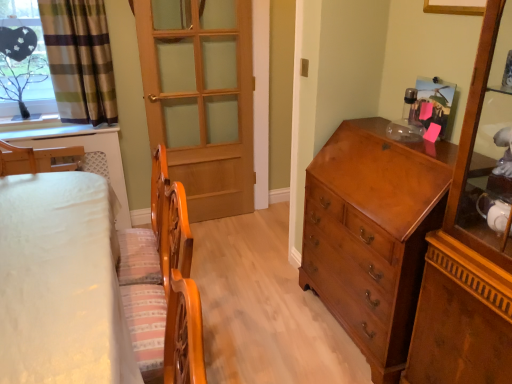
At what (x,y) coordinates should I click in order to perform the action: click on blank space situated above shiny brown wooden chest of drawers at right (from a real-world perspective). Please return your answer as a coordinate pair (x, y). The image size is (512, 384). Looking at the image, I should click on (395, 138).